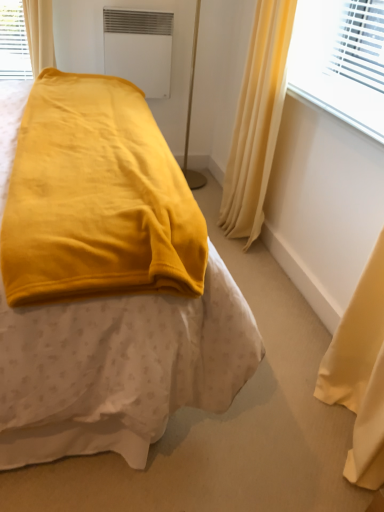
Question: Does point (352, 121) appear closer or farther from the camera than point (153, 90)?

Choices:
 (A) closer
 (B) farther

Answer: (A)

Question: In the image, is smooth plastic window sill at upper right on the left side or the right side of white matte air conditioning unit at upper center?

Choices:
 (A) right
 (B) left

Answer: (A)

Question: Which is nearer to the silky yellow curtain at upper right?

Choices:
 (A) white matte air conditioning unit at upper center
 (B) smooth plastic window sill at upper right
 (C) velvet yellow blanket at center

Answer: (B)

Question: Which object is the farthest from the white matte air conditioning unit at upper center?

Choices:
 (A) silky yellow curtain at upper right
 (B) smooth plastic window sill at upper right
 (C) velvet yellow blanket at center

Answer: (C)